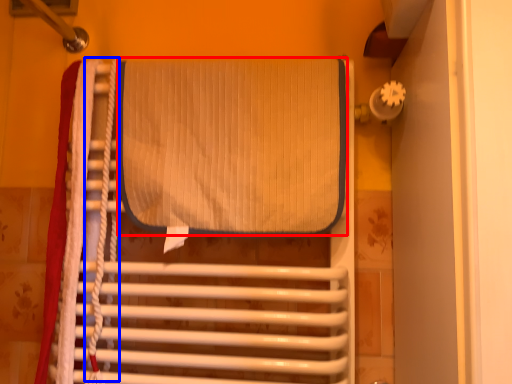
Question: Which of the following is the closest to the observer, wide (highlighted by a red box) or rope (highlighted by a blue box)?

Choices:
 (A) wide
 (B) rope

Answer: (A)